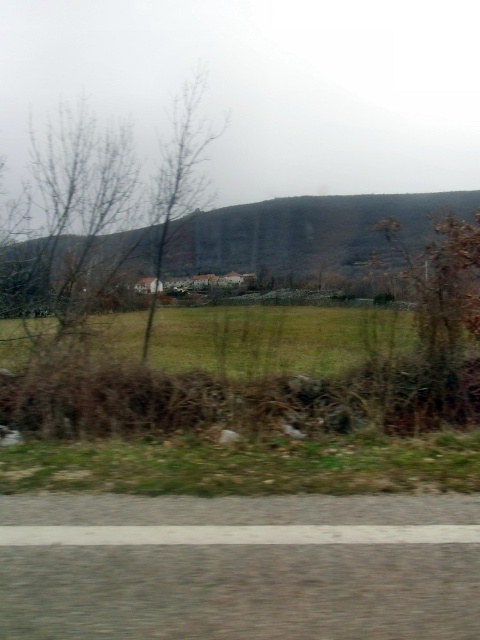
You are standing on the road and want to cross to the buildings in the midground. To avoid the bare branches at left, should you walk to the right or left of the green grassy field at center?

You should walk to the right of the green grassy field at center because the bare branches at left are on the left side of the green grassy field at center, so going right would avoid them.

You are standing on the road and want to take a photo of the bare branches at left. Where should you position yourself to ensure they are centered in your camera viewfinder?

To center the bare branches at left in your camera viewfinder, position yourself at point (110, 196).

You are standing on the road and looking towards the buildings. Which object, the bare branches at left or the green grassy field at center, is closer to you?

The bare branches at left are closer to you because the green grassy field at center is behind them.